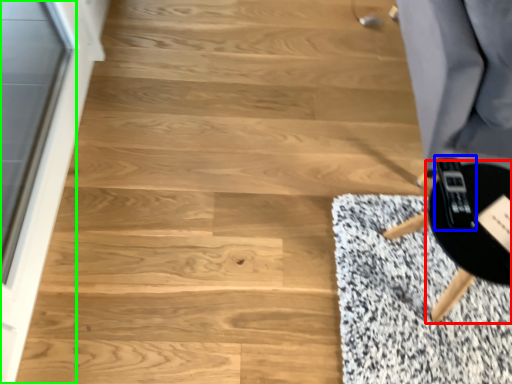
Question: Which object is the farthest from round table (highlighted by a red box)? Choose among these: game controller (highlighted by a blue box) or screen door (highlighted by a green box).

Choices:
 (A) game controller
 (B) screen door

Answer: (B)